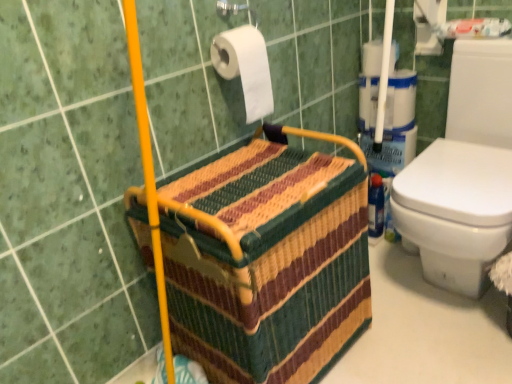
Question: Based on their sizes in the image, would you say multicolored woven basket at center is bigger or smaller than white matte toilet paper at upper center, which is the 1th toilet paper in left-to-right order?

Choices:
 (A) big
 (B) small

Answer: (A)

Question: Is point 250,168 closer or farther from the camera than point 254,114?

Choices:
 (A) farther
 (B) closer

Answer: (B)

Question: Which of these objects is positioned closest to the multicolored woven basket at center?

Choices:
 (A) white matte toilet paper at upper center, positioned as the second toilet paper in top-to-bottom order
 (B) white paper at upper center, the 2th toilet paper in the left-to-right sequence

Answer: (A)

Question: Based on their relative distances, which object is nearer to the multicolored woven basket at center?

Choices:
 (A) white paper at upper center, which is counted as the 1th toilet paper, starting from the right
 (B) white matte toilet paper at upper center, acting as the second toilet paper starting from the right

Answer: (B)